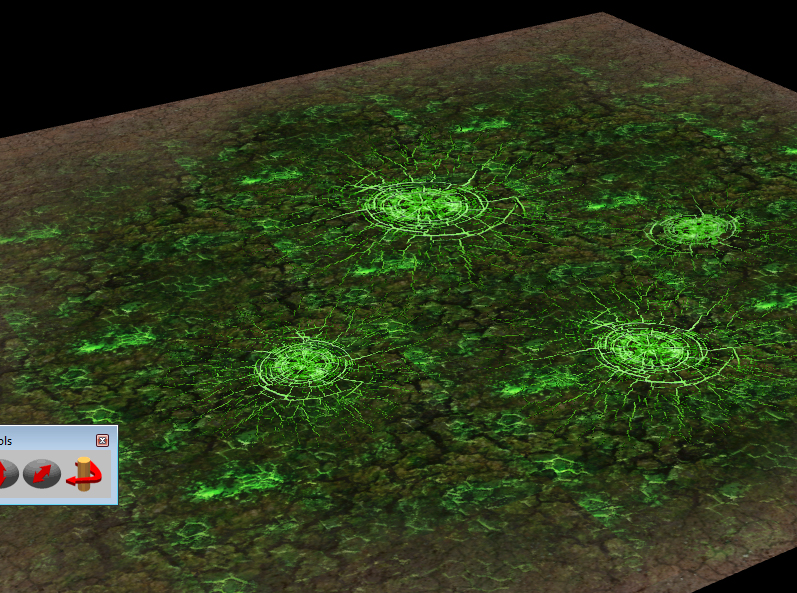
What are the coordinates of `empty space above floor` in the screenshot? It's located at (159, 44).